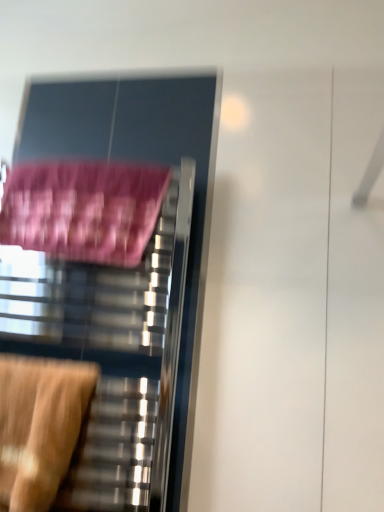
Question: Could pink fabric bath towel at left be considered to be inside metallic towel rack at left?

Choices:
 (A) yes
 (B) no

Answer: (A)

Question: From a real-world perspective, is metallic towel rack at left on pink fabric bath towel at left?

Choices:
 (A) yes
 (B) no

Answer: (B)

Question: From the image's perspective, is metallic towel rack at left located above pink fabric bath towel at left?

Choices:
 (A) yes
 (B) no

Answer: (B)

Question: Is the depth of metallic towel rack at left greater than that of pink fabric bath towel at left?

Choices:
 (A) yes
 (B) no

Answer: (B)

Question: From the image's perspective, is metallic towel rack at left below pink fabric bath towel at left?

Choices:
 (A) no
 (B) yes

Answer: (B)

Question: Is metallic towel rack at left next to pink fabric bath towel at left?

Choices:
 (A) yes
 (B) no

Answer: (B)

Question: Can you confirm if metallic towel rack at left is bigger than wooden swivel chair at lower left?

Choices:
 (A) no
 (B) yes

Answer: (B)

Question: Is metallic towel rack at left to the right of wooden swivel chair at lower left from the viewer's perspective?

Choices:
 (A) yes
 (B) no

Answer: (A)

Question: From the image's perspective, is metallic towel rack at left over wooden swivel chair at lower left?

Choices:
 (A) yes
 (B) no

Answer: (A)

Question: Is metallic towel rack at left oriented towards wooden swivel chair at lower left?

Choices:
 (A) yes
 (B) no

Answer: (A)

Question: Is metallic towel rack at left not inside wooden swivel chair at lower left?

Choices:
 (A) no
 (B) yes

Answer: (B)

Question: Can you confirm if metallic towel rack at left is wider than wooden swivel chair at lower left?

Choices:
 (A) no
 (B) yes

Answer: (A)

Question: Is wooden swivel chair at lower left oriented towards pink fabric bath towel at left?

Choices:
 (A) yes
 (B) no

Answer: (B)